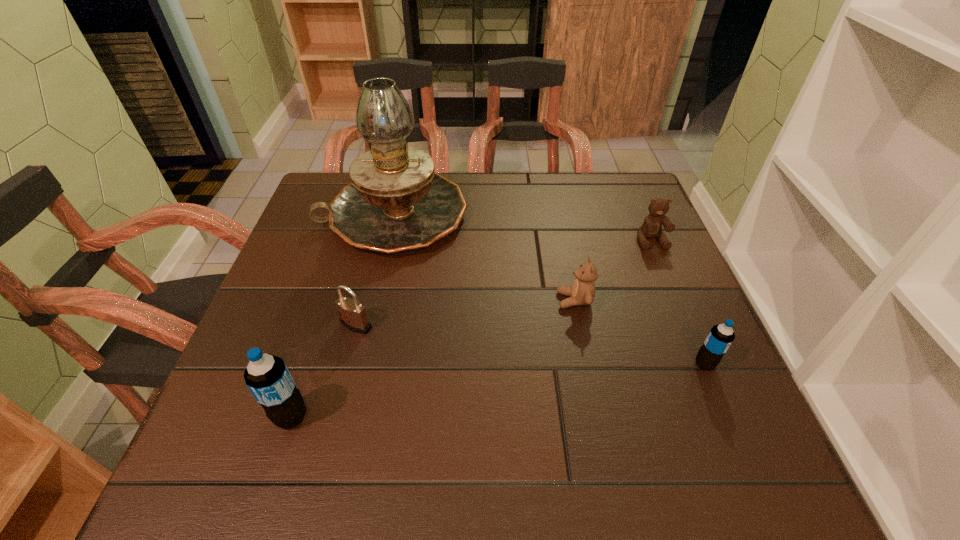
Find the location of a particular element. vacant area situated on the back of the shorter soda bottle is located at coordinates pyautogui.click(x=680, y=306).

You are a GUI agent. You are given a task and a screenshot of the screen. Output one action in this format:
    pyautogui.click(x=<x>, y=<y>)
    Task: Click on the vacant space located 0.090m on the right of the oil lamp
    The image size is (960, 540).
    Given the screenshot: What is the action you would take?
    pyautogui.click(x=501, y=215)

At what (x,y) coordinates should I click in order to perform the action: click on vacant region located on the front-facing side of the fourth object from left to right. Please return your answer as a coordinate pair (x, y). This screenshot has width=960, height=540. Looking at the image, I should click on (531, 300).

This screenshot has width=960, height=540. I want to click on vacant space situated 0.170m on the front-facing side of the fourth object from left to right, so click(482, 300).

Image resolution: width=960 pixels, height=540 pixels. Identify the location of vacant space situated on the front-facing side of the fourth object from left to right. click(x=482, y=300).

Identify the location of free space located 0.260m on the right of the padlock. This screenshot has height=540, width=960. (495, 325).

Identify the location of free spot located 0.150m on the face of the right teddy bear. (674, 294).

Where is `object located at the far edge`? The height and width of the screenshot is (540, 960). object located at the far edge is located at coordinates (396, 202).

This screenshot has height=540, width=960. Find the location of `object at the near edge`. object at the near edge is located at coordinates (267, 377).

This screenshot has width=960, height=540. Identify the location of soda bottle located at the left edge. (267, 377).